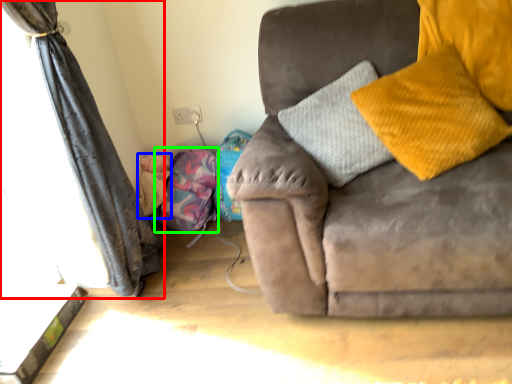
Question: Which is nearer to the curtain (highlighted by a red box)? baby (highlighted by a blue box) or bean bag chair (highlighted by a green box).

Choices:
 (A) baby
 (B) bean bag chair

Answer: (B)